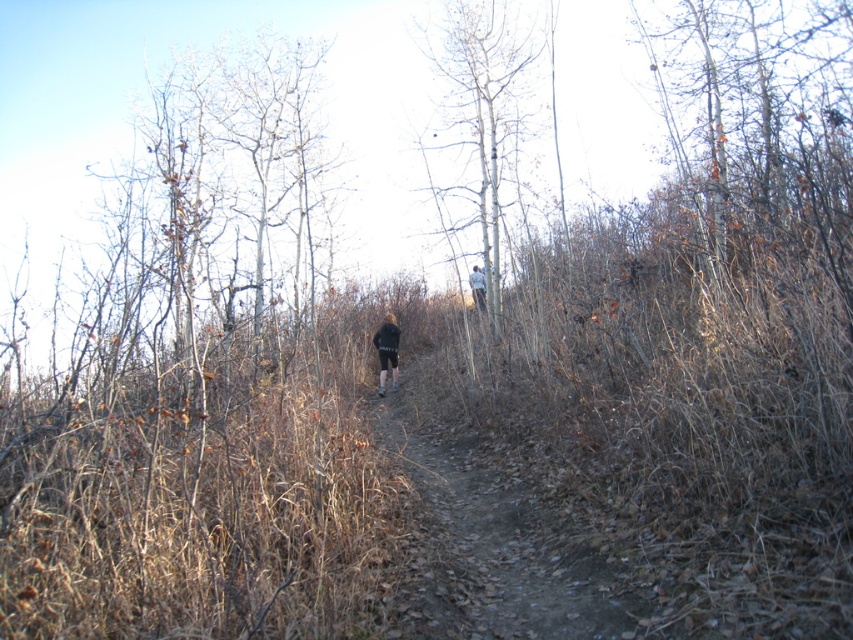
Consider the image. You are a hiker who has just finished a long trek and is standing on a narrow dirt trail through a forest. You see a dark gray fabric jacket at center. Where exactly is the dark gray fabric jacket located in terms of coordinates?

The dark gray fabric jacket at center is located at point (387, 349).

You are a hiker carrying a backpack and see the dirt path at center and the light blue denim jacket at upper center. Which object is wider?

The dirt path at center is wider than the light blue denim jacket at upper center according to the description.

You are standing on the narrow dirt trail in the forest and want to move towards the point labeled as point (485, 280). There is another point, point (384, 348), in your path. Which point will you reach first?

You will reach point (384, 348) first because it is closer to you than point (485, 280).